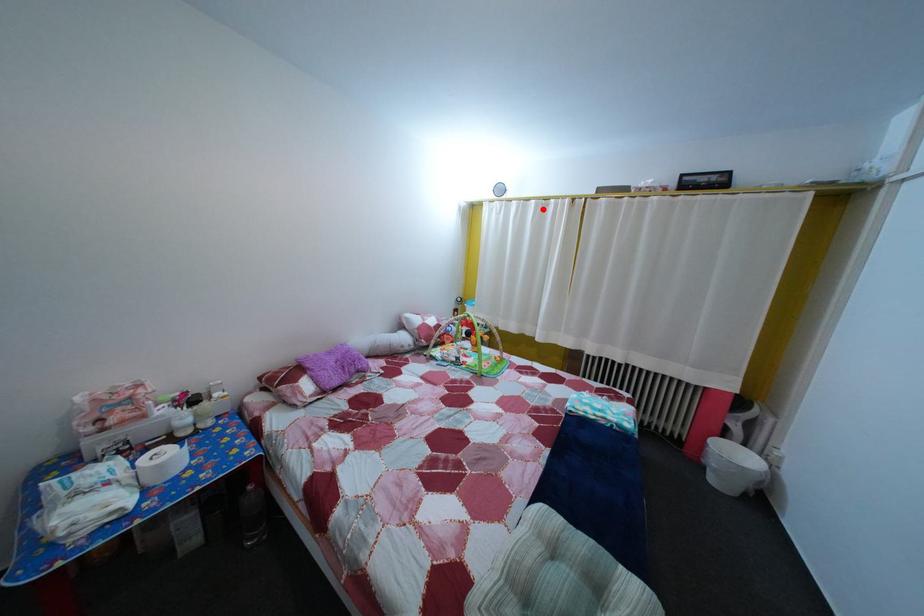
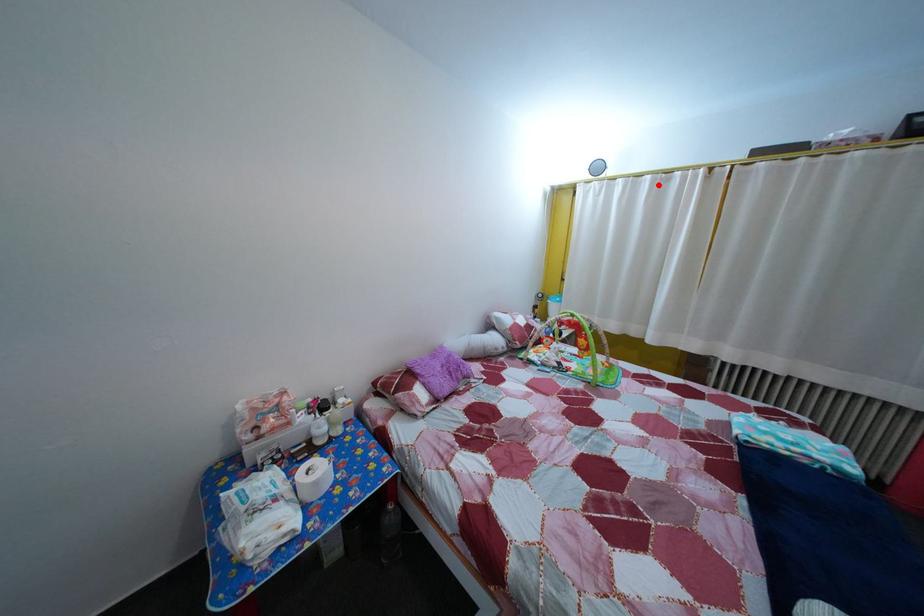
I am providing you with two images of the same scene from different viewpoints. A red point is marked on the first image and another point is marked on the second image. Do the highlighted points in image1 and image2 indicate the same real-world spot?

Yes